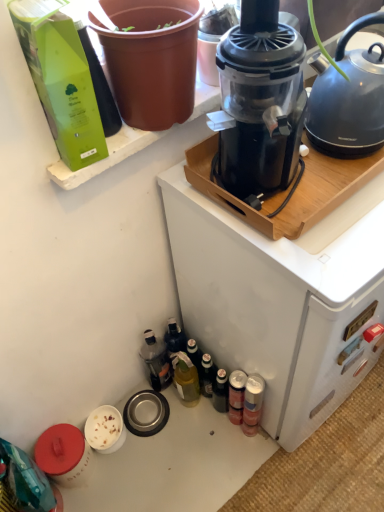
Where is `empty space that is ontop of black plastic coffee maker at upper center (from a real-world perspective)`? The image size is (384, 512). empty space that is ontop of black plastic coffee maker at upper center (from a real-world perspective) is located at coordinates (331, 206).